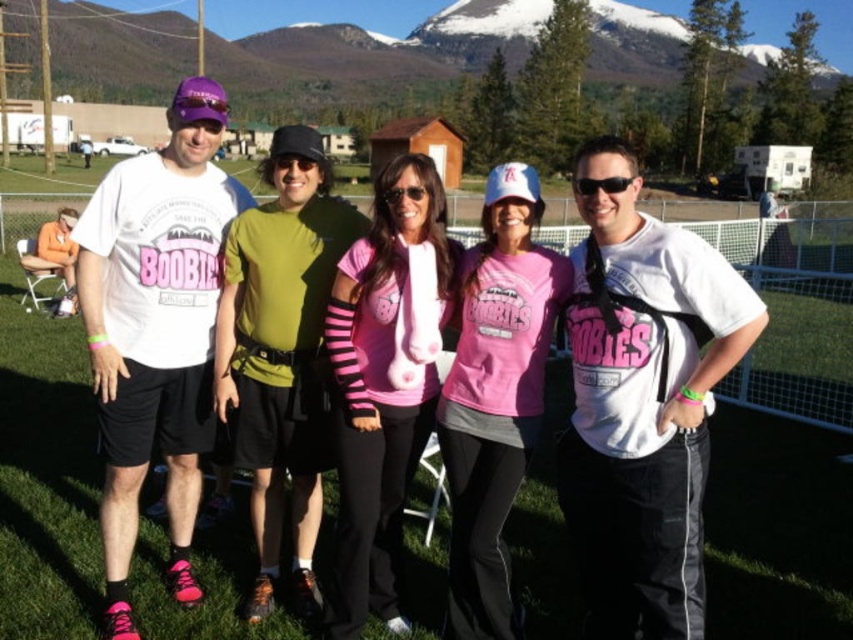
You are a photographer standing at the camera position. You want to take a closeup shot of the pink matte shirt at center. The camera has a maximum zoom range of 3 meters. Can you get a clear closeup without moving closer?

The pink matte shirt at center is 3.86 meters away from camera. Since the camera can only zoom up to 3 meters, you cannot get a clear closeup without moving closer.